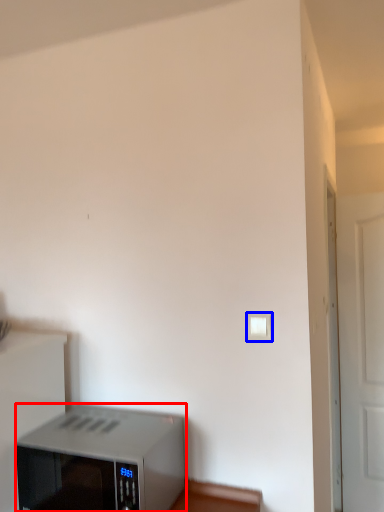
Question: Among these objects, which one is farthest to the camera, home appliance (highlighted by a red box) or light switch (highlighted by a blue box)?

Choices:
 (A) home appliance
 (B) light switch

Answer: (B)